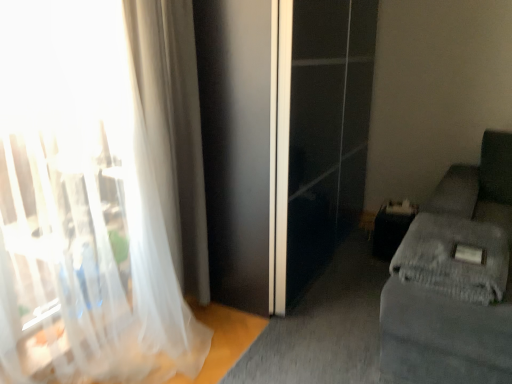
This screenshot has width=512, height=384. What do you see at coordinates (454, 258) in the screenshot?
I see `gray textured blanket at lower right` at bounding box center [454, 258].

How much space does white sheer curtain at left, positioned as the 2th curtain in back-to-front order, occupy vertically?

white sheer curtain at left, positioned as the 2th curtain in back-to-front order, is 1.42 meters tall.

The width and height of the screenshot is (512, 384). Identify the location of translucent fabric curtain at left, arranged as the 2th curtain when viewed from the front. (172, 132).

Is translucent fabric curtain at left, which ranks as the 1th curtain in back-to-front order, next to gray textured blanket at lower right and touching it?

No, translucent fabric curtain at left, which ranks as the 1th curtain in back-to-front order, is not in contact with gray textured blanket at lower right.

From a real-world perspective, is translucent fabric curtain at left, arranged as the 2th curtain when viewed from the front, positioned above or below gray textured blanket at lower right?

translucent fabric curtain at left, arranged as the 2th curtain when viewed from the front, is situated higher than gray textured blanket at lower right in the real world.

Looking at this image, is translucent fabric curtain at left, which ranks as the 1th curtain in back-to-front order, facing towards gray textured blanket at lower right?

No, translucent fabric curtain at left, which ranks as the 1th curtain in back-to-front order, is not aimed at gray textured blanket at lower right.

Between translucent fabric curtain at left, which ranks as the 1th curtain in back-to-front order, and gray textured blanket at lower right, which one has smaller size?

Smaller between the two is gray textured blanket at lower right.

Can you confirm if gray textured blanket at lower right is smaller than white sheer curtain at left, arranged as the 1th curtain when viewed from the front?

Yes, gray textured blanket at lower right is smaller than white sheer curtain at left, arranged as the 1th curtain when viewed from the front.

Between gray textured blanket at lower right and white sheer curtain at left, positioned as the 2th curtain in back-to-front order, which one is positioned in front?

white sheer curtain at left, positioned as the 2th curtain in back-to-front order, is more forward.

How many degrees apart are the facing directions of gray textured blanket at lower right and white sheer curtain at left, arranged as the 1th curtain when viewed from the front?

1.72 degrees.

Considering the sizes of gray textured blanket at lower right and white sheer curtain at left, positioned as the 2th curtain in back-to-front order, in the image, is gray textured blanket at lower right wider or thinner than white sheer curtain at left, positioned as the 2th curtain in back-to-front order,?

Clearly, gray textured blanket at lower right has more width compared to white sheer curtain at left, positioned as the 2th curtain in back-to-front order.

In terms of height, does translucent fabric curtain at left, arranged as the 2th curtain when viewed from the front, look taller or shorter compared to white sheer curtain at left, arranged as the 1th curtain when viewed from the front?

Clearly, translucent fabric curtain at left, arranged as the 2th curtain when viewed from the front, is taller compared to white sheer curtain at left, arranged as the 1th curtain when viewed from the front.

Who is bigger, translucent fabric curtain at left, arranged as the 2th curtain when viewed from the front, or white sheer curtain at left, positioned as the 2th curtain in back-to-front order?

white sheer curtain at left, positioned as the 2th curtain in back-to-front order.

From the image's perspective, is translucent fabric curtain at left, which ranks as the 1th curtain in back-to-front order, over white sheer curtain at left, positioned as the 2th curtain in back-to-front order?

Yes, from the image's perspective, translucent fabric curtain at left, which ranks as the 1th curtain in back-to-front order, is above white sheer curtain at left, positioned as the 2th curtain in back-to-front order.

Considering their positions, is gray fabric couch at right located in front of or behind white sheer curtain at left, positioned as the 2th curtain in back-to-front order?

Clearly, gray fabric couch at right is behind white sheer curtain at left, positioned as the 2th curtain in back-to-front order.

Is gray fabric couch at right far away from white sheer curtain at left, positioned as the 2th curtain in back-to-front order?

gray fabric couch at right is far away from white sheer curtain at left, positioned as the 2th curtain in back-to-front order.

How many degrees apart are the facing directions of gray fabric couch at right and white sheer curtain at left, positioned as the 2th curtain in back-to-front order?

gray fabric couch at right and white sheer curtain at left, positioned as the 2th curtain in back-to-front order, are facing 88.2 degrees away from each other.

Between point (422, 229) and point (57, 287), which one is positioned behind?

Point (422, 229)

What's the angular difference between gray textured blanket at lower right and translucent fabric curtain at left, arranged as the 2th curtain when viewed from the front,'s facing directions?

There is a 3.57-degree angle between the facing directions of gray textured blanket at lower right and translucent fabric curtain at left, arranged as the 2th curtain when viewed from the front.

Can translucent fabric curtain at left, arranged as the 2th curtain when viewed from the front, be found inside gray textured blanket at lower right?

No.

Is gray textured blanket at lower right wider or thinner than translucent fabric curtain at left, arranged as the 2th curtain when viewed from the front?

gray textured blanket at lower right is thinner than translucent fabric curtain at left, arranged as the 2th curtain when viewed from the front.

Considering the sizes of objects translucent fabric curtain at left, which ranks as the 1th curtain in back-to-front order, and gray fabric couch at right in the image provided, who is thinner, translucent fabric curtain at left, which ranks as the 1th curtain in back-to-front order, or gray fabric couch at right?

With smaller width is translucent fabric curtain at left, which ranks as the 1th curtain in back-to-front order.

From the image's perspective, which is above, translucent fabric curtain at left, which ranks as the 1th curtain in back-to-front order, or gray fabric couch at right?

From the image's view, translucent fabric curtain at left, which ranks as the 1th curtain in back-to-front order, is above.

Does translucent fabric curtain at left, arranged as the 2th curtain when viewed from the front, contain gray fabric couch at right?

No, gray fabric couch at right is not inside translucent fabric curtain at left, arranged as the 2th curtain when viewed from the front.

Does translucent fabric curtain at left, arranged as the 2th curtain when viewed from the front, come in front of gray fabric couch at right?

No, the depth of translucent fabric curtain at left, arranged as the 2th curtain when viewed from the front, is greater than that of gray fabric couch at right.

Is gray textured blanket at lower right completely or partially outside of gray fabric couch at right?

No.

Does gray textured blanket at lower right touch gray fabric couch at right?

Yes, gray textured blanket at lower right is next to gray fabric couch at right.

Who is shorter, gray textured blanket at lower right or gray fabric couch at right?

Standing shorter between the two is gray textured blanket at lower right.

Find the location of a particular element. Image resolution: width=512 pixels, height=384 pixels. sheet below the translucent fabric curtain at left, which ranks as the 1th curtain in back-to-front order (from the image's perspective) is located at coordinates (454, 258).

From the gray textured blanket at lower right, count the 2nd curtain to the left and point to it. Please provide its 2D coordinates.

[(82, 207)]

Looking at the image, which one is located further to gray fabric couch at right, white sheer curtain at left, arranged as the 1th curtain when viewed from the front, or translucent fabric curtain at left, arranged as the 2th curtain when viewed from the front?

The object further to gray fabric couch at right is white sheer curtain at left, arranged as the 1th curtain when viewed from the front.

When comparing their distances from gray fabric couch at right, does translucent fabric curtain at left, which ranks as the 1th curtain in back-to-front order, or white sheer curtain at left, arranged as the 1th curtain when viewed from the front, seem further?

Among the two, white sheer curtain at left, arranged as the 1th curtain when viewed from the front, is located further to gray fabric couch at right.

Which object lies nearer to the anchor point white sheer curtain at left, positioned as the 2th curtain in back-to-front order, translucent fabric curtain at left, which ranks as the 1th curtain in back-to-front order, or gray fabric couch at right?

translucent fabric curtain at left, which ranks as the 1th curtain in back-to-front order, lies closer to white sheer curtain at left, positioned as the 2th curtain in back-to-front order, than the other object.

When comparing their distances from gray fabric couch at right, does gray textured blanket at lower right or translucent fabric curtain at left, arranged as the 2th curtain when viewed from the front, seem closer?

gray textured blanket at lower right is closer to gray fabric couch at right.

Based on the photo, from the image, which object appears to be nearer to gray fabric couch at right, white sheer curtain at left, positioned as the 2th curtain in back-to-front order, or gray textured blanket at lower right?

Among the two, gray textured blanket at lower right is located nearer to gray fabric couch at right.

When comparing their distances from gray textured blanket at lower right, does translucent fabric curtain at left, arranged as the 2th curtain when viewed from the front, or white sheer curtain at left, positioned as the 2th curtain in back-to-front order, seem closer?

The object closer to gray textured blanket at lower right is translucent fabric curtain at left, arranged as the 2th curtain when viewed from the front.

Based on their spatial positions, is white sheer curtain at left, arranged as the 1th curtain when viewed from the front, or translucent fabric curtain at left, arranged as the 2th curtain when viewed from the front, closer to gray textured blanket at lower right?

translucent fabric curtain at left, arranged as the 2th curtain when viewed from the front.

Looking at the image, which one is located further to gray textured blanket at lower right, gray fabric couch at right or white sheer curtain at left, positioned as the 2th curtain in back-to-front order?

white sheer curtain at left, positioned as the 2th curtain in back-to-front order.

Identify the location of curtain between white sheer curtain at left, positioned as the 2th curtain in back-to-front order, and gray textured blanket at lower right from left to right. The height and width of the screenshot is (384, 512). (172, 132).

The image size is (512, 384). In order to click on sheet between white sheer curtain at left, positioned as the 2th curtain in back-to-front order, and gray fabric couch at right from left to right in this screenshot , I will do `click(454, 258)`.

At what (x,y) coordinates should I click in order to perform the action: click on sheet located between translucent fabric curtain at left, arranged as the 2th curtain when viewed from the front, and gray fabric couch at right in the left-right direction. Please return your answer as a coordinate pair (x, y). Looking at the image, I should click on (454, 258).

I want to click on curtain between white sheer curtain at left, arranged as the 1th curtain when viewed from the front, and gray fabric couch at right, in the horizontal direction, so click(x=172, y=132).